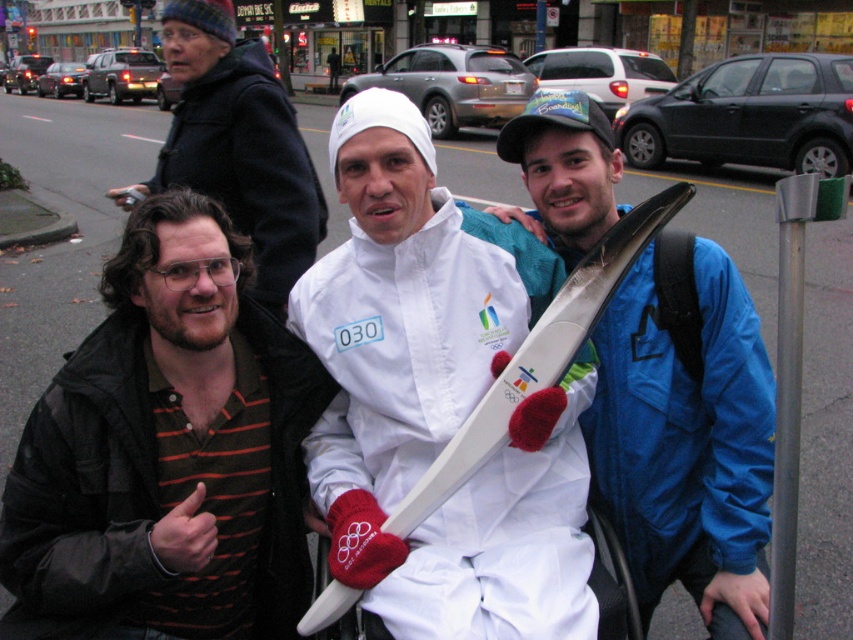
Question: Considering the real-world distances, which object is farthest from the blue synthetic jacket at center?

Choices:
 (A) brown striped shirt at center
 (B) white matte olympic torch at center

Answer: (A)

Question: Is brown striped shirt at center positioned at the back of white matte olympic torch at center?

Choices:
 (A) no
 (B) yes

Answer: (B)

Question: Which object is closer to the camera taking this photo?

Choices:
 (A) white matte olympic torch at center
 (B) brown woolen hat at upper left
 (C) blue synthetic jacket at center

Answer: (A)

Question: Is brown striped shirt at center closer to camera compared to brown woolen hat at upper left?

Choices:
 (A) no
 (B) yes

Answer: (B)

Question: Estimate the real-world distances between objects in this image. Which object is farther from the brown woolen hat at upper left?

Choices:
 (A) blue synthetic jacket at center
 (B) brown striped shirt at center

Answer: (A)

Question: Can you confirm if white matte olympic torch at center is smaller than blue synthetic jacket at center?

Choices:
 (A) yes
 (B) no

Answer: (A)